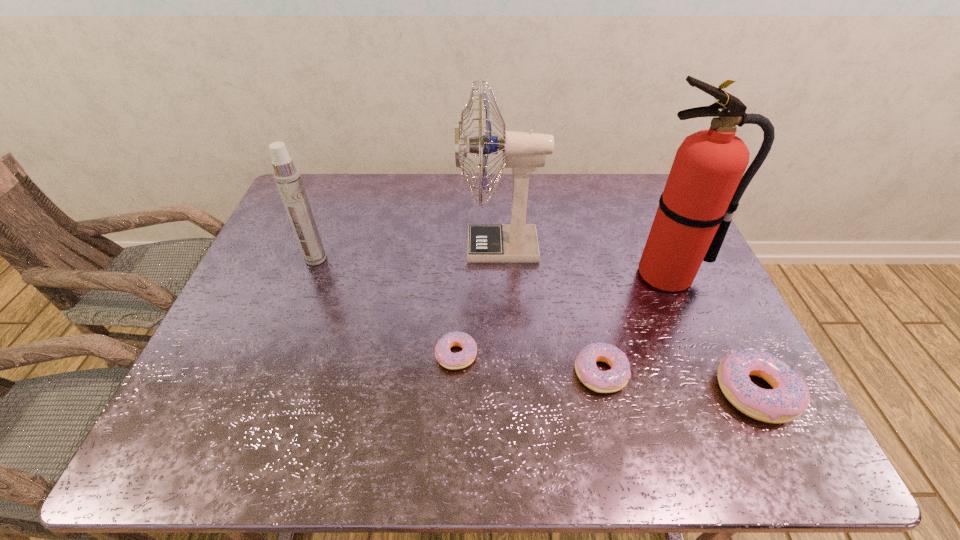
Where is `vacant spot to place a doughnut on the left`? This screenshot has width=960, height=540. vacant spot to place a doughnut on the left is located at coordinates (321, 338).